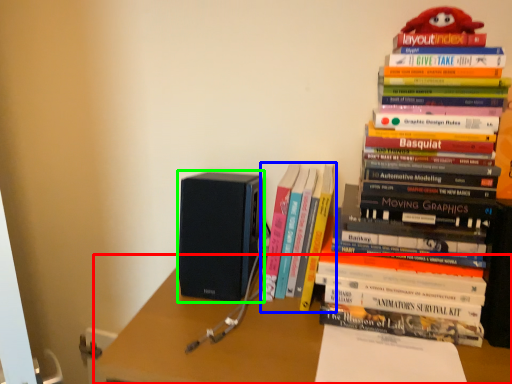
Question: Estimate the real-world distances between objects in this image. Which object is closer to desk (highlighted by a red box), book (highlighted by a blue box) or speaker (highlighted by a green box)?

Choices:
 (A) book
 (B) speaker

Answer: (B)